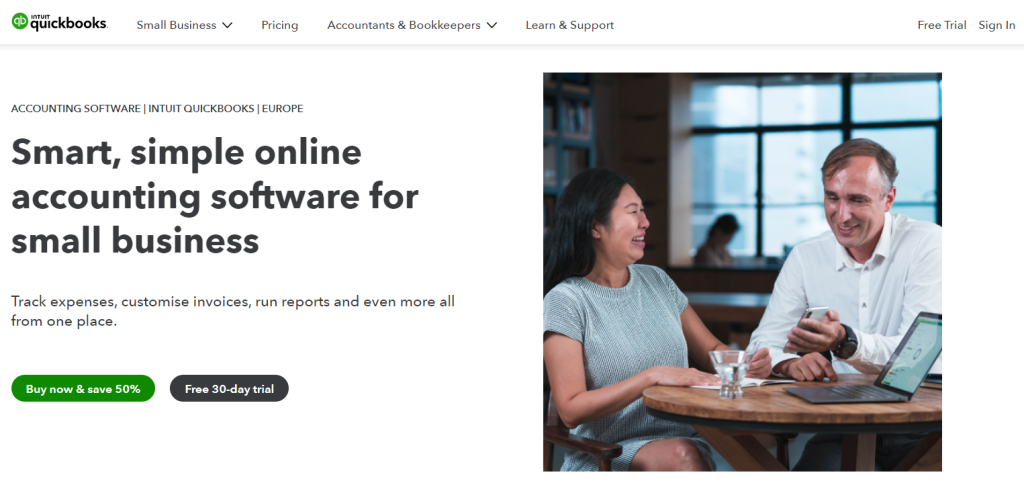
Find the location of `window panes`. window panes is located at coordinates (792, 145), (731, 183), (912, 147), (924, 213), (790, 224), (749, 242), (700, 104), (801, 110), (903, 101).